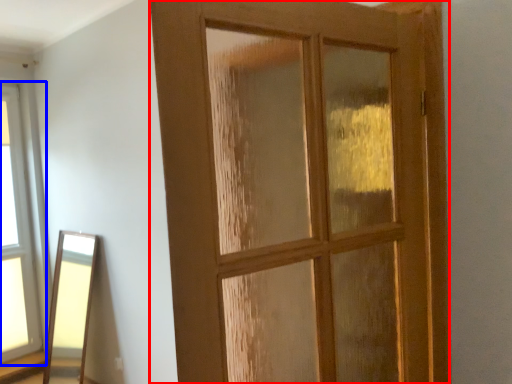
Question: Which point is closer to the camera, door (highlighted by a red box) or window (highlighted by a blue box)?

Choices:
 (A) door
 (B) window

Answer: (A)